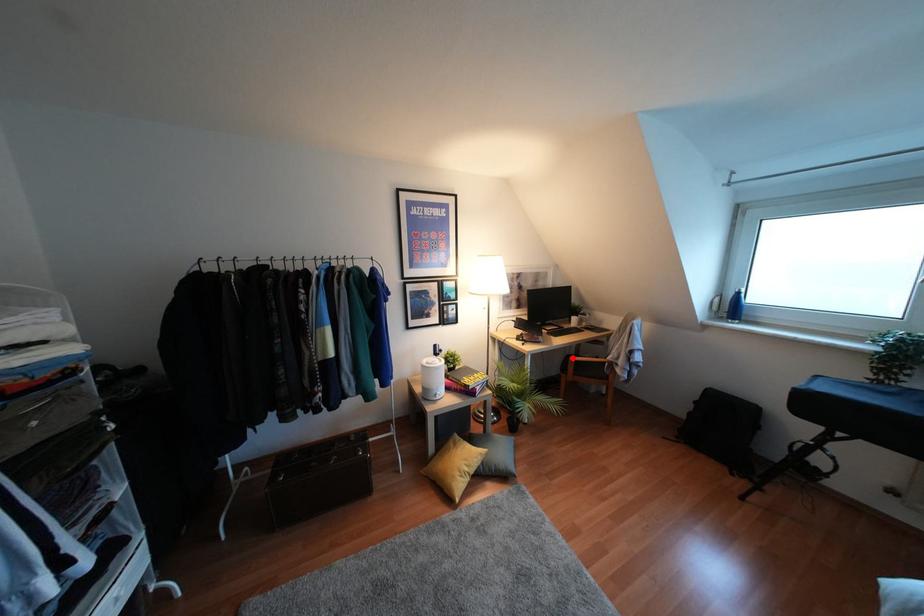
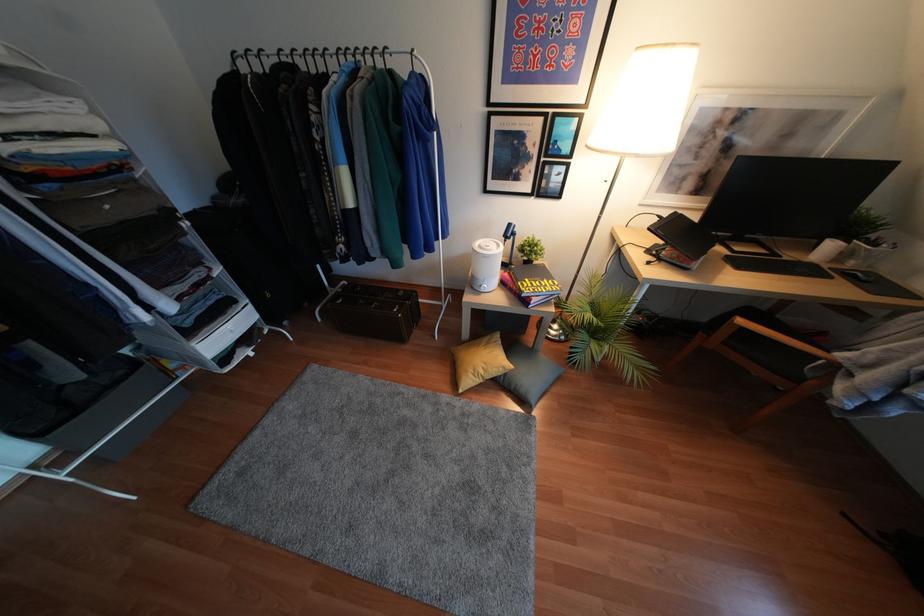
Question: A red point is marked in image1. In image2, is the corresponding 3D point closer to the camera or farther? Reply with the corresponding letter.

Choices:
 (A) The corresponding 3D point is closer.
 (B) The corresponding 3D point is farther.

Answer: (A)